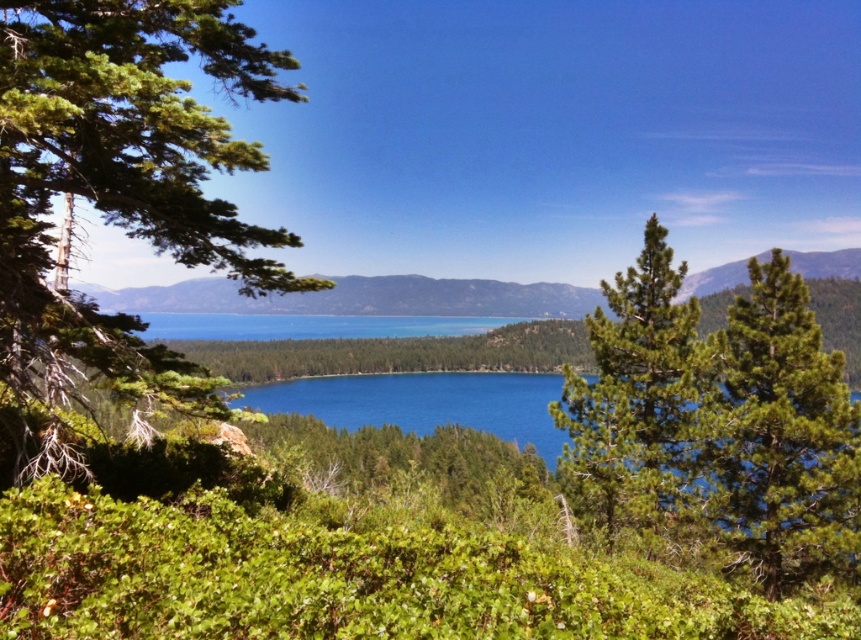
You are standing at the point labeled as point (119,195) in the image. What type of object is located at this point?

The point (119,195) indicates a green leafy tree at left.